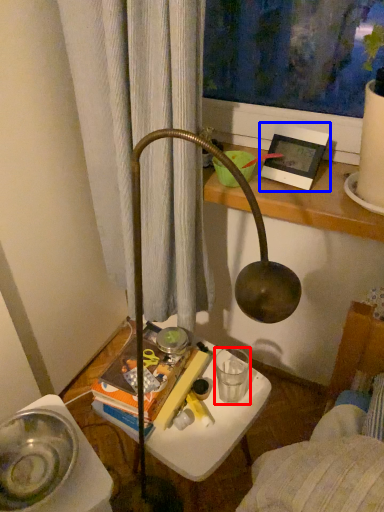
Question: Which object appears farthest to the camera in this image, beverage (highlighted by a red box) or picture frame (highlighted by a blue box)?

Choices:
 (A) beverage
 (B) picture frame

Answer: (A)